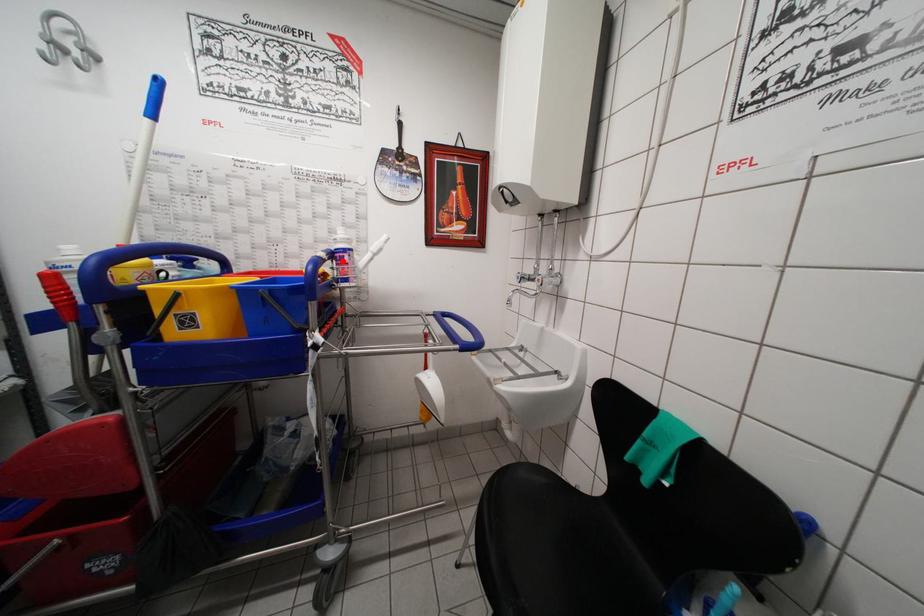
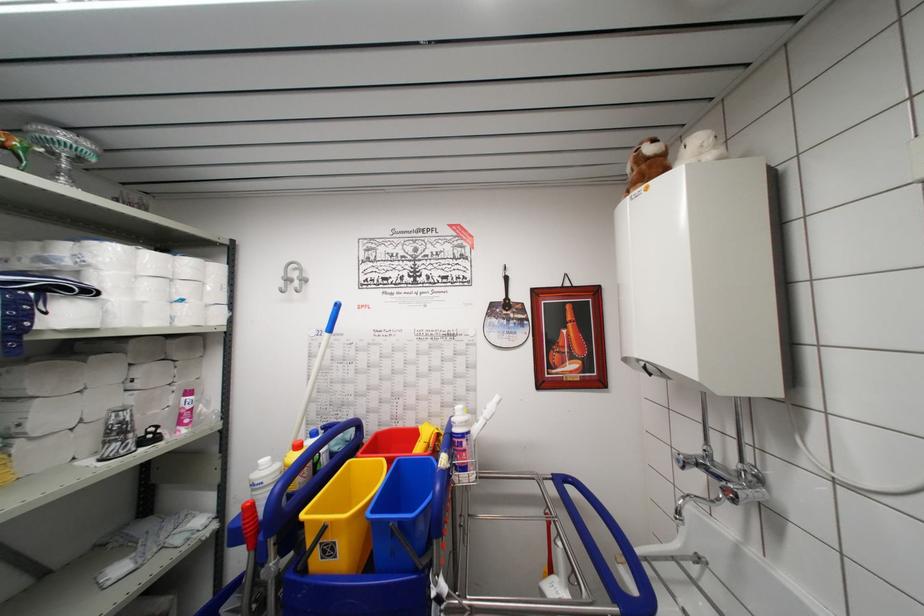
Question: I am providing you with two images of the same scene from different viewpoints. Image1 has a red point marked. In image2, the corresponding 3D location appears at what relative position? Reply with the corresponding letter.

Choices:
 (A) Closer
 (B) Farther

Answer: (B)